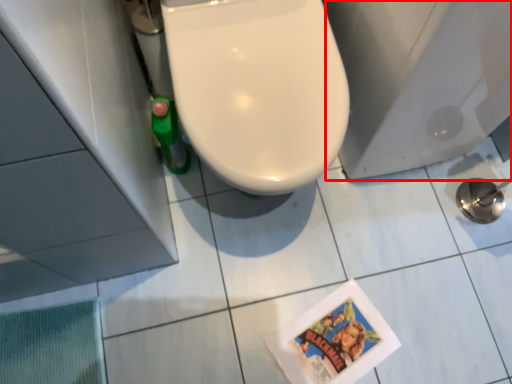
Question: Where is porcelain (annotated by the red box) located in relation to ceramic tile in the image?

Choices:
 (A) right
 (B) left

Answer: (B)